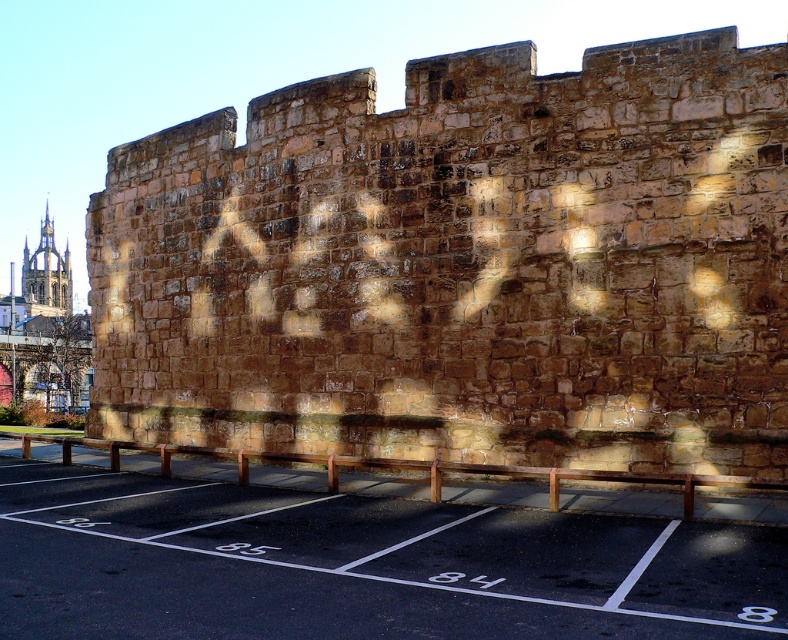
Question: Is brown stone wall at center closer to the viewer compared to golden stone tower at upper left?

Choices:
 (A) no
 (B) yes

Answer: (B)

Question: Can you confirm if brown stone wall at center is smaller than black asphalt parking lot at lower center?

Choices:
 (A) yes
 (B) no

Answer: (B)

Question: Does brown stone wall at center appear over black asphalt parking lot at lower center?

Choices:
 (A) no
 (B) yes

Answer: (B)

Question: Among these points, which one is farthest from the camera?

Choices:
 (A) (651, 182)
 (B) (54, 253)
 (C) (500, 595)

Answer: (B)

Question: Among these objects, which one is nearest to the camera?

Choices:
 (A) black asphalt parking lot at lower center
 (B) brown stone wall at center
 (C) golden stone tower at upper left

Answer: (A)

Question: Considering the real-world distances, which object is closest to the black asphalt parking lot at lower center?

Choices:
 (A) brown stone wall at center
 (B) golden stone tower at upper left

Answer: (A)